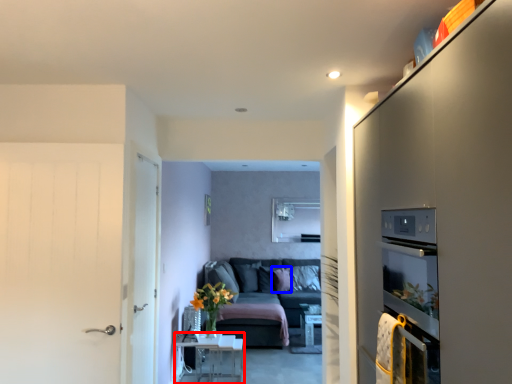
Question: Which point is further to the camera, table (highlighted by a red box) or pillow (highlighted by a blue box)?

Choices:
 (A) table
 (B) pillow

Answer: (B)